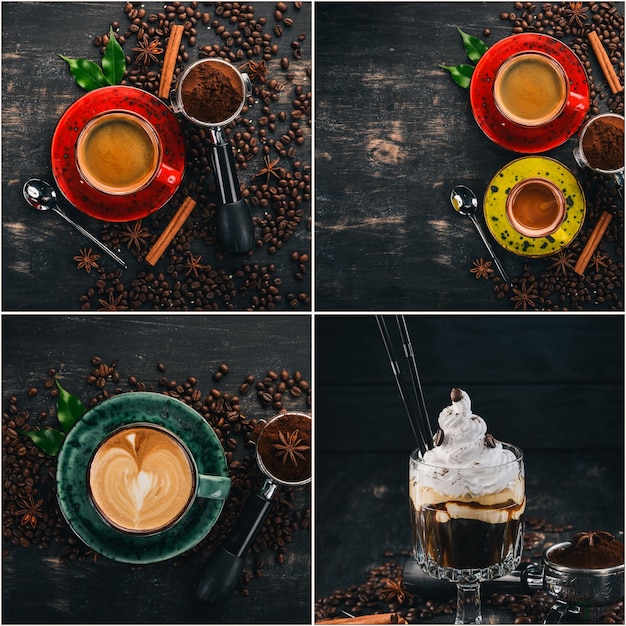
This screenshot has height=626, width=626. I want to click on coffee inside of mugs, so click(x=146, y=483), click(x=130, y=166), click(x=534, y=98), click(x=538, y=210).